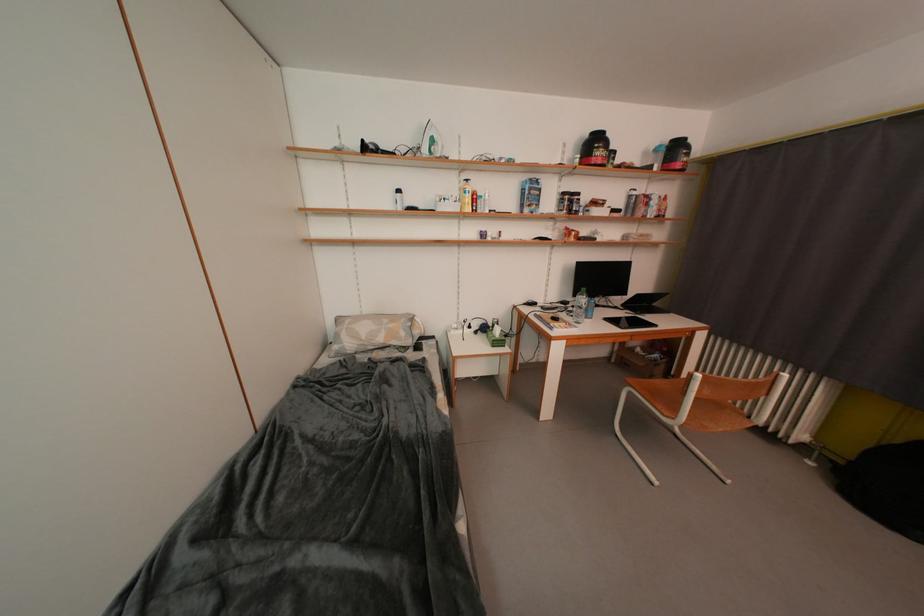
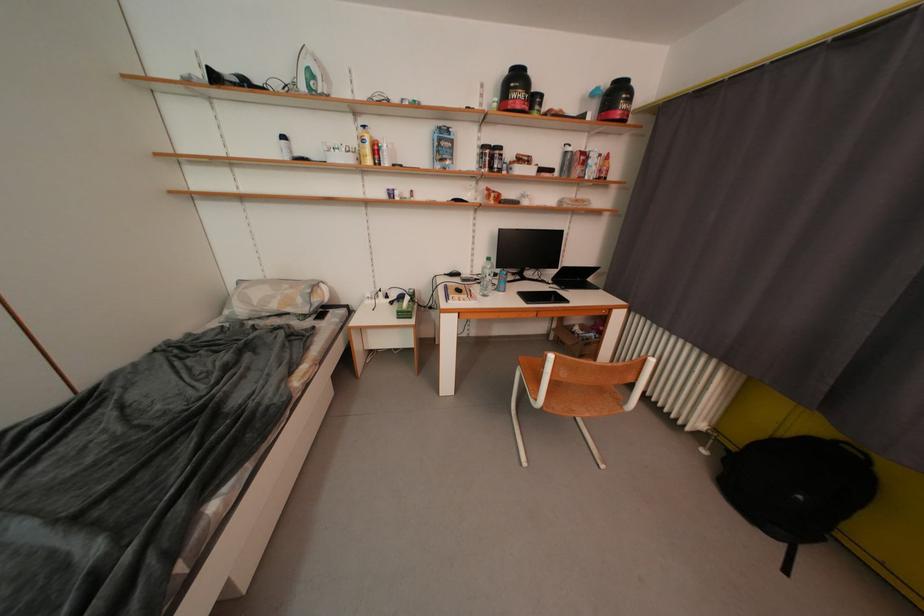
Question: Based on the continuous images, in which direction is the camera rotating? Reply with the corresponding letter.

Choices:
 (A) Left
 (B) Right
 (C) Up
 (D) Down

Answer: (D)